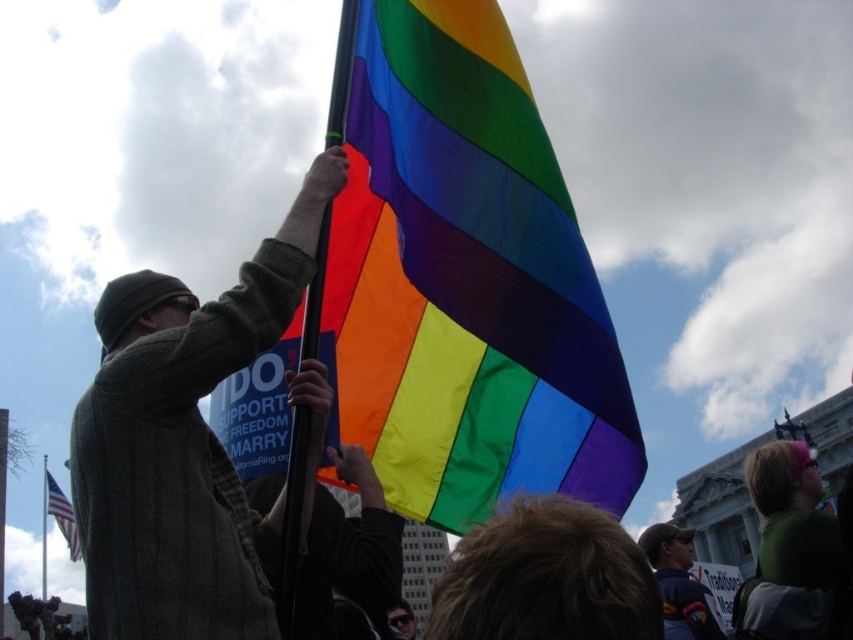
Question: Can you confirm if knit green sweater at center is smaller than dark blue baseball cap at lower right?

Choices:
 (A) yes
 (B) no

Answer: (A)

Question: Can you confirm if knit green sweater at center is positioned to the right of dark blue baseball cap at lower right?

Choices:
 (A) yes
 (B) no

Answer: (B)

Question: Does rainbow fabric flag at center appear under american flag at lower left?

Choices:
 (A) yes
 (B) no

Answer: (B)

Question: Considering the real-world distances, which object is farthest from the american flag at lower left?

Choices:
 (A) knit green sweater at center
 (B) rainbow fabric flag at center

Answer: (B)

Question: Which point is farther from the camera taking this photo?

Choices:
 (A) (672, 582)
 (B) (363, 301)
 (C) (195, 470)

Answer: (A)

Question: Which point appears closest to the camera in this image?

Choices:
 (A) (407, 125)
 (B) (61, 525)
 (C) (114, 280)
 (D) (701, 611)

Answer: (A)